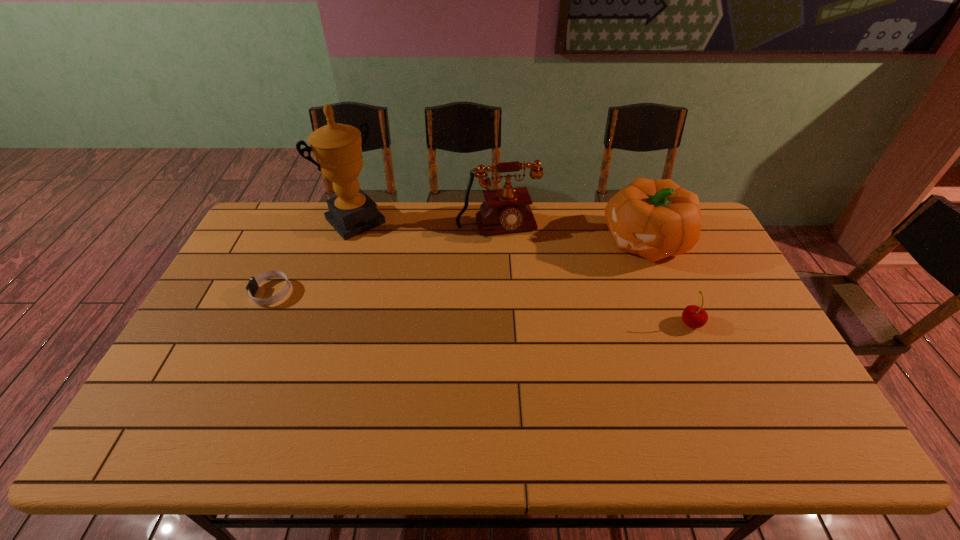
At what (x,y) coordinates should I click in order to perform the action: click on the shortest object. Please return your answer as a coordinate pair (x, y). The height and width of the screenshot is (540, 960). Looking at the image, I should click on (252, 286).

Where is `the leftmost object`? Image resolution: width=960 pixels, height=540 pixels. the leftmost object is located at coordinates (252, 286).

Identify the location of the nearest object. (693, 316).

Where is `the fourth tallest object`? the fourth tallest object is located at coordinates (693, 316).

What are the coordinates of `the tallest object` in the screenshot? It's located at (337, 148).

I want to click on the second object from left to right, so click(337, 148).

This screenshot has height=540, width=960. Identify the location of pumpkin. (655, 219).

Find the location of `the third object from left to right`. the third object from left to right is located at coordinates (504, 210).

Locate an element on the screen. The image size is (960, 540). free region located 0.200m on the front of the cherry is located at coordinates (723, 397).

What are the coordinates of `free point located at the front of the award with handles` in the screenshot? It's located at (390, 256).